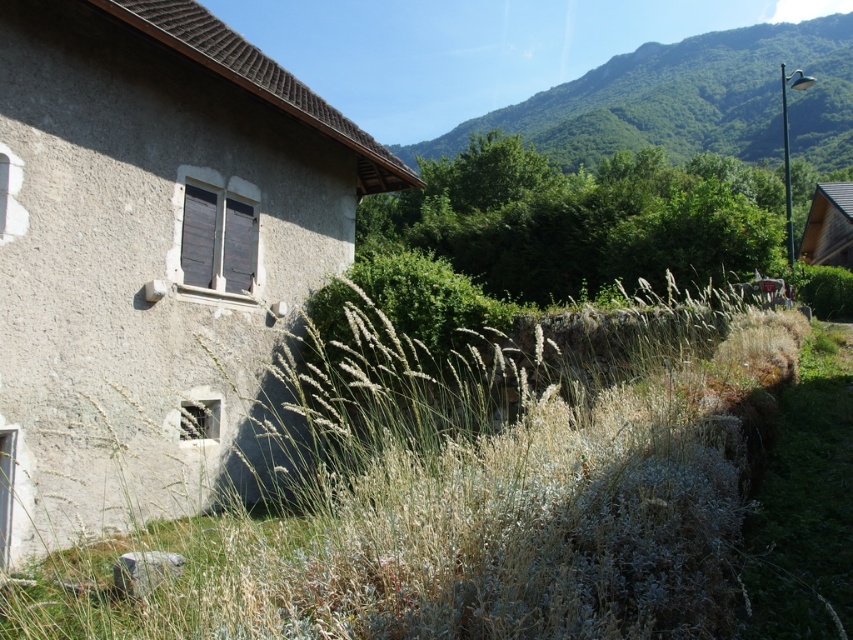
Question: Among these points, which one is farthest from the camera?

Choices:
 (A) (717, 141)
 (B) (96, 451)

Answer: (A)

Question: Can you confirm if gray stucco wall at left is smaller than green leafy hillside at upper center?

Choices:
 (A) no
 (B) yes

Answer: (B)

Question: Is gray stucco wall at left above green leafy hillside at upper center?

Choices:
 (A) yes
 (B) no

Answer: (B)

Question: Estimate the real-world distances between objects in this image. Which object is closer to the gray stucco wall at left?

Choices:
 (A) green leafy hillside at upper center
 (B) wooden hut at right

Answer: (B)

Question: Is green grass at center to the right of green leafy hillside at upper center from the viewer's perspective?

Choices:
 (A) no
 (B) yes

Answer: (A)

Question: Which object is closer to the camera taking this photo?

Choices:
 (A) wooden hut at right
 (B) gray stucco wall at left
 (C) green grass at center
 (D) green leafy hillside at upper center

Answer: (C)